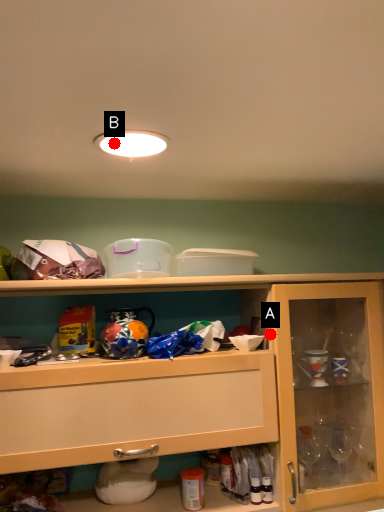
Question: Two points are circled on the image, labeled by A and B beside each circle. Which of the following is the closest to the observer?

Choices:
 (A) A is closer
 (B) B is closer

Answer: (B)